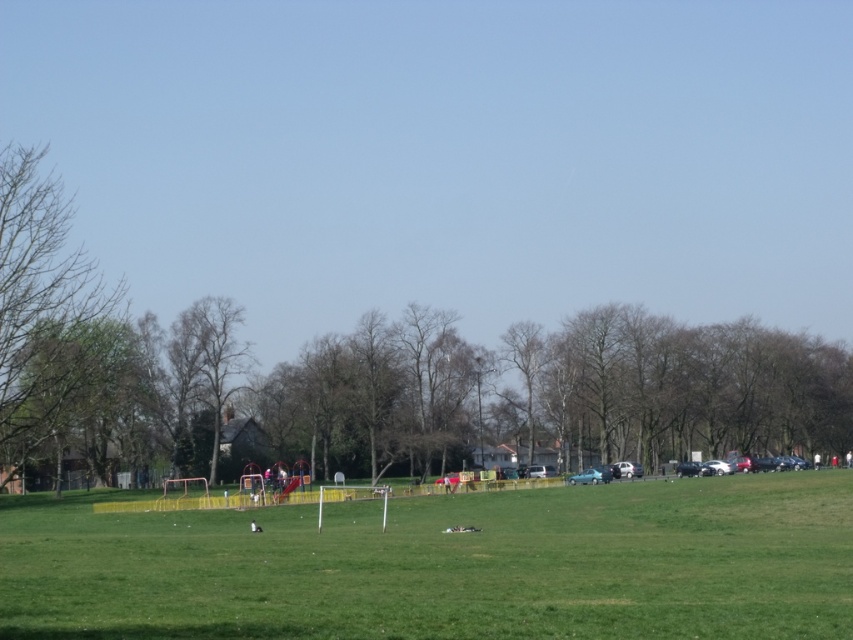
Question: Can you confirm if green grassy field at center is positioned to the right of brown wood tree at center?

Choices:
 (A) no
 (B) yes

Answer: (B)

Question: Does green grassy field at center have a smaller size compared to brown wood tree at center?

Choices:
 (A) no
 (B) yes

Answer: (A)

Question: Among these points, which one is farthest from the camera?

Choices:
 (A) tap(62, 429)
 (B) tap(453, 611)

Answer: (A)

Question: Which object appears closest to the camera in this image?

Choices:
 (A) green leafy tree at left
 (B) brown wood tree at center

Answer: (A)

Question: Is green grassy field at center further to the viewer compared to brown wood tree at center?

Choices:
 (A) no
 (B) yes

Answer: (A)

Question: Which object is positioned farthest from the green leafy tree at left?

Choices:
 (A) green grassy field at center
 (B) brown wood tree at center

Answer: (B)